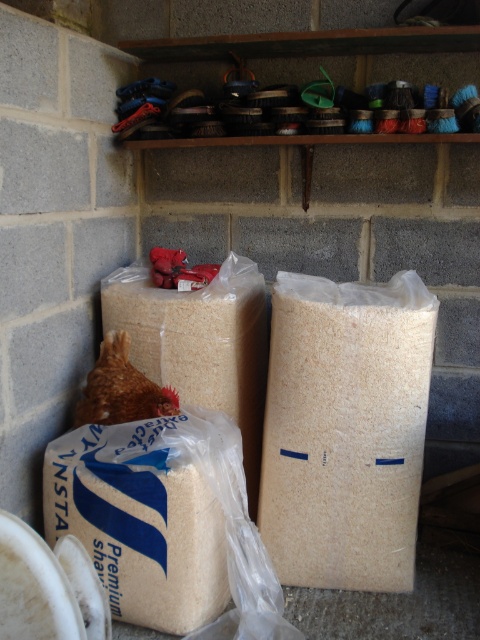
Between point (322, 406) and point (119, 368), which one is positioned in front?

Point (322, 406)

Who is taller, white matte paper bag at center or brown feathered chicken at lower left?

Standing taller between the two is white matte paper bag at center.

Image resolution: width=480 pixels, height=640 pixels. Identify the location of white matte paper bag at center. (346, 429).

Locate an element on the screen. white matte paper bag at center is located at coordinates click(x=346, y=429).